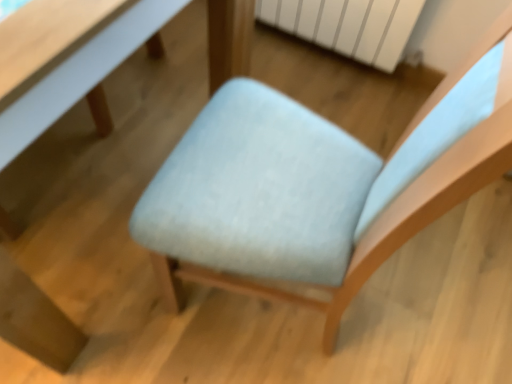
How much space does matte light blue table at center, arranged as the 1th table when viewed from the left, occupy vertically?

80.84 centimeters.

How much space does white glossy table at upper left, acting as the 2th table starting from the left, occupy vertically?

The height of white glossy table at upper left, acting as the 2th table starting from the left, is 10.82 inches.

I want to click on matte light blue table at center, arranged as the 1th table when viewed from the left, so click(35, 320).

Considering the relative sizes of white glossy table at upper left, the first table in the right-to-left sequence, and white matte radiator at upper center in the image provided, is white glossy table at upper left, the first table in the right-to-left sequence, wider than white matte radiator at upper center?

Correct, the width of white glossy table at upper left, the first table in the right-to-left sequence, exceeds that of white matte radiator at upper center.

Is white matte radiator at upper center at the back of white glossy table at upper left, acting as the 2th table starting from the left?

white glossy table at upper left, acting as the 2th table starting from the left, is not turned away from white matte radiator at upper center.

Does white glossy table at upper left, acting as the 2th table starting from the left, appear on the left side of white matte radiator at upper center?

Yes.

Which object is closer to the camera, white glossy table at upper left, acting as the 2th table starting from the left, or white matte radiator at upper center?

white glossy table at upper left, acting as the 2th table starting from the left, is in front.

Based on the photo, considering the relative positions of white matte radiator at upper center and light blue fabric chair at center in the image provided, is white matte radiator at upper center to the right of light blue fabric chair at center from the viewer's perspective?

Indeed, white matte radiator at upper center is positioned on the right side of light blue fabric chair at center.

Locate an element on the screen. Image resolution: width=512 pixels, height=384 pixels. chair in front of the white matte radiator at upper center is located at coordinates (385, 200).

How much distance is there between white matte radiator at upper center and light blue fabric chair at center?

white matte radiator at upper center is 91.35 centimeters from light blue fabric chair at center.

In the image, is white matte radiator at upper center positioned in front of or behind light blue fabric chair at center?

Visually, white matte radiator at upper center is located behind light blue fabric chair at center.

Is matte light blue table at center, the 2th table viewed from the right, shorter than white matte radiator at upper center?

No.

Consider the image. Do you think matte light blue table at center, arranged as the 1th table when viewed from the left, is within white matte radiator at upper center, or outside of it?

matte light blue table at center, arranged as the 1th table when viewed from the left, is outside white matte radiator at upper center.

Considering the sizes of objects matte light blue table at center, arranged as the 1th table when viewed from the left, and white matte radiator at upper center in the image provided, who is smaller, matte light blue table at center, arranged as the 1th table when viewed from the left, or white matte radiator at upper center?

white matte radiator at upper center is smaller.

Considering the relative positions of matte light blue table at center, the 2th table viewed from the right, and white matte radiator at upper center in the image provided, is matte light blue table at center, the 2th table viewed from the right, in front of white matte radiator at upper center?

Yes, it is in front of white matte radiator at upper center.

Who is taller, matte light blue table at center, arranged as the 1th table when viewed from the left, or white glossy table at upper left, acting as the 2th table starting from the left?

With more height is matte light blue table at center, arranged as the 1th table when viewed from the left.

Which object is further away from the camera, matte light blue table at center, arranged as the 1th table when viewed from the left, or white glossy table at upper left, acting as the 2th table starting from the left?

white glossy table at upper left, acting as the 2th table starting from the left, is further away from the camera.

Is matte light blue table at center, arranged as the 1th table when viewed from the left, looking in the opposite direction of white glossy table at upper left, the first table in the right-to-left sequence?

That's right, matte light blue table at center, arranged as the 1th table when viewed from the left, is facing away from white glossy table at upper left, the first table in the right-to-left sequence.

Is matte light blue table at center, arranged as the 1th table when viewed from the left, not near white glossy table at upper left, acting as the 2th table starting from the left?

matte light blue table at center, arranged as the 1th table when viewed from the left, is actually quite close to white glossy table at upper left, acting as the 2th table starting from the left.

Is point (135, 14) behind point (138, 11)?

Yes, it is behind point (138, 11).

From the picture: How different are the orientations of white glossy table at upper left, acting as the 2th table starting from the left, and matte light blue table at center, the 2th table viewed from the right, in degrees?

0.886 degrees.

From the image's perspective, would you say white glossy table at upper left, the first table in the right-to-left sequence, is positioned over matte light blue table at center, the 2th table viewed from the right?

Yes, from the image's perspective, white glossy table at upper left, the first table in the right-to-left sequence, is over matte light blue table at center, the 2th table viewed from the right.

Is white glossy table at upper left, the first table in the right-to-left sequence, facing towards matte light blue table at center, arranged as the 1th table when viewed from the left?

Yes.

Is white glossy table at upper left, acting as the 2th table starting from the left, oriented away from light blue fabric chair at center?

No, white glossy table at upper left, acting as the 2th table starting from the left,'s orientation is not away from light blue fabric chair at center.

From the image's perspective, is white glossy table at upper left, the first table in the right-to-left sequence, positioned above or below light blue fabric chair at center?

From the image's perspective, white glossy table at upper left, the first table in the right-to-left sequence, appears above light blue fabric chair at center.

Is white glossy table at upper left, acting as the 2th table starting from the left, wider than light blue fabric chair at center?

No.

Is point (42, 111) positioned behind point (449, 168)?

Yes, it is behind point (449, 168).

Is white matte radiator at upper center facing away from matte light blue table at center, the 2th table viewed from the right?

No, white matte radiator at upper center is not facing away from matte light blue table at center, the 2th table viewed from the right.

Considering the relative positions of white matte radiator at upper center and matte light blue table at center, arranged as the 1th table when viewed from the left, in the image provided, is white matte radiator at upper center behind matte light blue table at center, arranged as the 1th table when viewed from the left,?

Yes, white matte radiator at upper center is further from the viewer.

Would you say white matte radiator at upper center is outside matte light blue table at center, the 2th table viewed from the right?

Yes, white matte radiator at upper center is outside of matte light blue table at center, the 2th table viewed from the right.

How distant is white matte radiator at upper center from matte light blue table at center, arranged as the 1th table when viewed from the left?

white matte radiator at upper center is 1.32 meters from matte light blue table at center, arranged as the 1th table when viewed from the left.

At what (x,y) coordinates should I click in order to perform the action: click on table that appears below the white matte radiator at upper center (from a real-world perspective). Please return your answer as a coordinate pair (x, y). This screenshot has height=384, width=512. Looking at the image, I should click on (80, 75).

Where is `radiator above the light blue fabric chair at center (from the image's perspective)`? The height and width of the screenshot is (384, 512). radiator above the light blue fabric chair at center (from the image's perspective) is located at coordinates (348, 25).

Considering their positions, is light blue fabric chair at center positioned further to matte light blue table at center, arranged as the 1th table when viewed from the left, than white glossy table at upper left, the first table in the right-to-left sequence?

The object further to matte light blue table at center, arranged as the 1th table when viewed from the left, is light blue fabric chair at center.

Looking at the image, which one is located further to light blue fabric chair at center, white matte radiator at upper center or matte light blue table at center, arranged as the 1th table when viewed from the left?

Based on the image, white matte radiator at upper center appears to be further to light blue fabric chair at center.

Looking at the image, which one is located further to light blue fabric chair at center, white glossy table at upper left, acting as the 2th table starting from the left, or white matte radiator at upper center?

white matte radiator at upper center.

Based on their spatial positions, is matte light blue table at center, the 2th table viewed from the right, or white glossy table at upper left, the first table in the right-to-left sequence, closer to light blue fabric chair at center?

Among the two, white glossy table at upper left, the first table in the right-to-left sequence, is located nearer to light blue fabric chair at center.

Based on their spatial positions, is white glossy table at upper left, the first table in the right-to-left sequence, or light blue fabric chair at center further from white matte radiator at upper center?

The object further to white matte radiator at upper center is white glossy table at upper left, the first table in the right-to-left sequence.

Estimate the real-world distances between objects in this image. Which object is closer to white matte radiator at upper center, white glossy table at upper left, the first table in the right-to-left sequence, or matte light blue table at center, the 2th table viewed from the right?

Based on the image, white glossy table at upper left, the first table in the right-to-left sequence, appears to be nearer to white matte radiator at upper center.

When comparing their distances from white matte radiator at upper center, does light blue fabric chair at center or white glossy table at upper left, acting as the 2th table starting from the left, seem closer?

The object closer to white matte radiator at upper center is light blue fabric chair at center.

From the image, which object appears to be nearer to white glossy table at upper left, acting as the 2th table starting from the left, light blue fabric chair at center or matte light blue table at center, the 2th table viewed from the right?

The object closer to white glossy table at upper left, acting as the 2th table starting from the left, is matte light blue table at center, the 2th table viewed from the right.

The image size is (512, 384). In order to click on table between light blue fabric chair at center and white glossy table at upper left, acting as the 2th table starting from the left, along the z-axis in this screenshot , I will do `click(35, 320)`.

Identify the location of table located between matte light blue table at center, the 2th table viewed from the right, and white matte radiator at upper center in the depth direction. (80, 75).